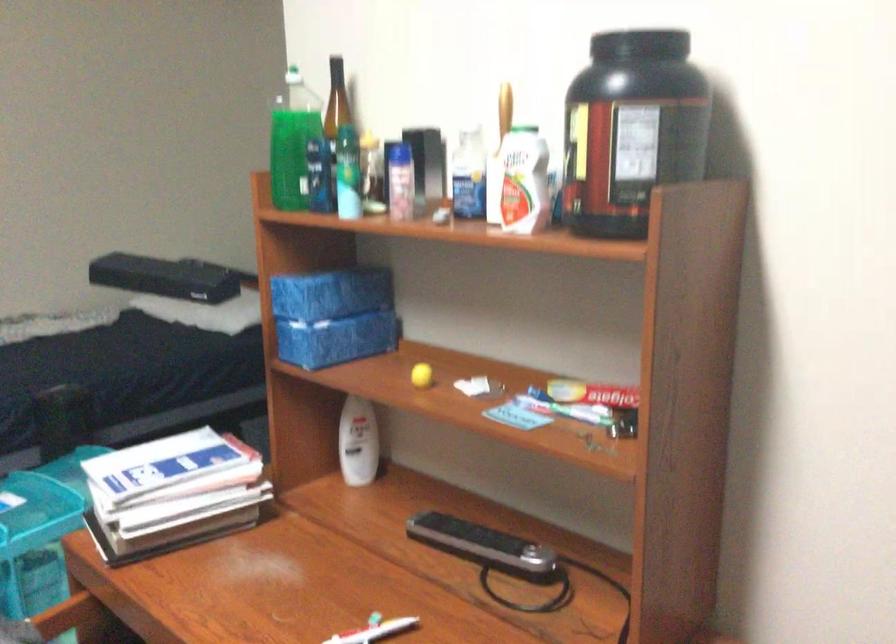
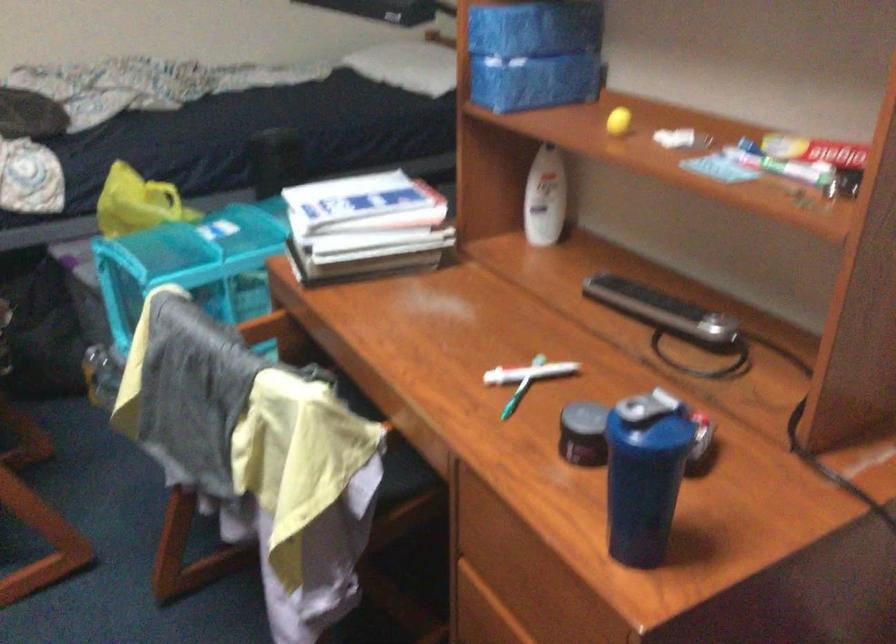
Locate, in the second image, the point that corresponds to point (339, 339) in the first image.

(533, 82)